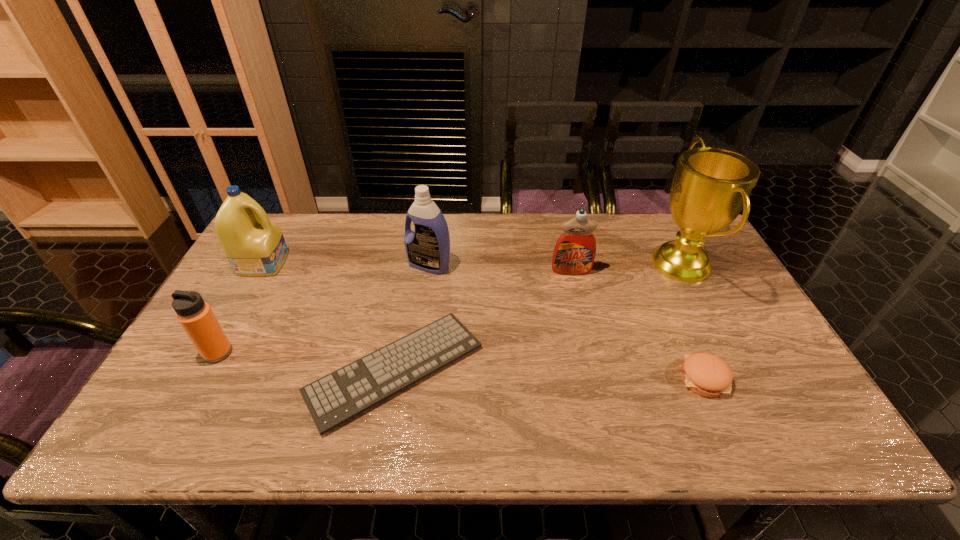
Find the location of a particular element. award is located at coordinates (711, 186).

You are a GUI agent. You are given a task and a screenshot of the screen. Output one action in this format:
    pyautogui.click(x=<x>, y=<y>)
    Task: Click on the second detergent from left to right
    The height and width of the screenshot is (540, 960).
    Given the screenshot: What is the action you would take?
    pyautogui.click(x=427, y=248)

Locate an element on the screen. This screenshot has width=960, height=540. the leftmost detergent is located at coordinates (255, 247).

You are a GUI agent. You are given a task and a screenshot of the screen. Output one action in this format:
    pyautogui.click(x=<x>, y=<y>)
    Task: Click on the fifth object from left to right
    The height and width of the screenshot is (540, 960).
    Given the screenshot: What is the action you would take?
    pyautogui.click(x=574, y=253)

Identify the location of the rightmost detergent. (574, 253).

Find the location of `thermos bottle`. thermos bottle is located at coordinates (196, 317).

Identify the location of the second shortest object. This screenshot has height=540, width=960. (705, 374).

This screenshot has height=540, width=960. What are the coordinates of `the shortest object` in the screenshot? It's located at (332, 400).

Locate an element on the screen. This screenshot has width=960, height=540. vacant space positioned on the shiny surface of the tallest object is located at coordinates (612, 265).

At what (x,y) coordinates should I click in order to perform the action: click on blank space located 0.110m on the shiny surface of the tallest object. Please return your answer as a coordinate pair (x, y). Looking at the image, I should click on (614, 265).